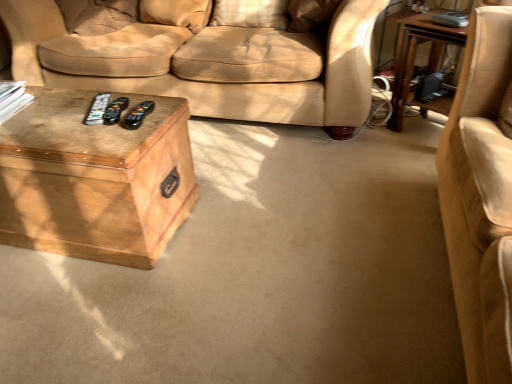
What is the approximate width of black plastic remote at center, the 1th remote in the left-to-right sequence?

It is 9.34 inches.

Image resolution: width=512 pixels, height=384 pixels. Describe the element at coordinates (138, 115) in the screenshot. I see `black plastic remote at center, which is counted as the first remote, starting from the right` at that location.

You are a GUI agent. You are given a task and a screenshot of the screen. Output one action in this format:
    pyautogui.click(x=<x>, y=<y>)
    Task: Click on the black plastic remote at center, the 2th remote viewed from the left
    The width and height of the screenshot is (512, 384).
    Given the screenshot: What is the action you would take?
    pyautogui.click(x=115, y=110)

Considering the relative sizes of black plastic remote at center, the 3th remote in the left-to-right sequence, and black plastic remote at center, arranged as the 2th remote when viewed from the right, in the image provided, is black plastic remote at center, the 3th remote in the left-to-right sequence, bigger than black plastic remote at center, arranged as the 2th remote when viewed from the right,?

Actually, black plastic remote at center, the 3th remote in the left-to-right sequence, might be smaller than black plastic remote at center, arranged as the 2th remote when viewed from the right.

Which is behind, point (127, 122) or point (125, 105)?

The point (125, 105) is farther.

In the image, is black plastic remote at center, the 3th remote in the left-to-right sequence, positioned in front of or behind black plastic remote at center, the 2th remote viewed from the left?

In the image, black plastic remote at center, the 3th remote in the left-to-right sequence, appears in front of black plastic remote at center, the 2th remote viewed from the left.

In order to click on remote below the black plastic remote at center, arranged as the 2th remote when viewed from the right (from the image's perspective) in this screenshot , I will do `click(138, 115)`.

From a real-world perspective, which is physically below, black plastic remote at center, arranged as the 2th remote when viewed from the right, or black plastic remote at center, which is counted as the first remote, starting from the right?

From a 3D spatial view, black plastic remote at center, arranged as the 2th remote when viewed from the right, is below.

Is black plastic remote at center, arranged as the 2th remote when viewed from the right, facing towards black plastic remote at center, the 3th remote in the left-to-right sequence?

No, black plastic remote at center, arranged as the 2th remote when viewed from the right, is not oriented towards black plastic remote at center, the 3th remote in the left-to-right sequence.

Which is less distant, (x=123, y=103) or (x=147, y=106)?

The point (x=147, y=106) is closer.

From the black plastic remote at center, the 3th remote in the left-to-right sequence, count the 1st remote to the left and point to it. Please provide its 2D coordinates.

[(115, 110)]

Is black plastic remote at center, marked as the 3th remote in a right-to-left arrangement, not close to wooden table at right, the second table when ordered from left to right?

Yes, black plastic remote at center, marked as the 3th remote in a right-to-left arrangement, and wooden table at right, the second table when ordered from left to right, are located far from each other.

Is black plastic remote at center, the 1th remote in the left-to-right sequence, positioned before wooden table at right, the second table when ordered from left to right?

Yes, it is.

Which object is positioned more to the right, black plastic remote at center, the 1th remote in the left-to-right sequence, or wooden table at right, the second table when ordered from left to right?

wooden table at right, the second table when ordered from left to right, is more to the right.

Is black plastic remote at center, the 1th remote in the left-to-right sequence, wider than wooden table at right, arranged as the first table when viewed from the right?

Incorrect, the width of black plastic remote at center, the 1th remote in the left-to-right sequence, does not surpass that of wooden table at right, arranged as the first table when viewed from the right.

Measure the distance between black plastic remote at center, marked as the 3th remote in a right-to-left arrangement, and black plastic remote at center, arranged as the 2th remote when viewed from the right.

black plastic remote at center, marked as the 3th remote in a right-to-left arrangement, and black plastic remote at center, arranged as the 2th remote when viewed from the right, are 1.56 inches apart from each other.

Considering the positions of objects black plastic remote at center, the 1th remote in the left-to-right sequence, and black plastic remote at center, the 2th remote viewed from the left, in the image provided, who is in front, black plastic remote at center, the 1th remote in the left-to-right sequence, or black plastic remote at center, the 2th remote viewed from the left,?

Positioned in front is black plastic remote at center, the 2th remote viewed from the left.

Considering the positions of points (89, 124) and (106, 119), is point (89, 124) closer to camera compared to point (106, 119)?

Yes, point (89, 124) is in front of point (106, 119).

Is black plastic remote at center, the 1th remote in the left-to-right sequence, next to black plastic remote at center, arranged as the 2th remote when viewed from the right, and touching it?

Yes, black plastic remote at center, the 1th remote in the left-to-right sequence, is in contact with black plastic remote at center, arranged as the 2th remote when viewed from the right.

Is wooden table at right, arranged as the first table when viewed from the right, turned away from wooden trunk at lower left, acting as the first table starting from the left?

That's not correct — wooden table at right, arranged as the first table when viewed from the right, is not looking away from wooden trunk at lower left, acting as the first table starting from the left.

Considering the sizes of wooden table at right, the second table when ordered from left to right, and wooden trunk at lower left, which is the second table in right-to-left order, in the image, is wooden table at right, the second table when ordered from left to right, taller or shorter than wooden trunk at lower left, which is the second table in right-to-left order,?

Considering their sizes, wooden table at right, the second table when ordered from left to right, has more height than wooden trunk at lower left, which is the second table in right-to-left order.

Is there a large distance between wooden table at right, arranged as the first table when viewed from the right, and wooden trunk at lower left, which is the second table in right-to-left order?

Absolutely, wooden table at right, arranged as the first table when viewed from the right, is distant from wooden trunk at lower left, which is the second table in right-to-left order.

Can you confirm if wooden table at right, the second table when ordered from left to right, is positioned to the left of wooden trunk at lower left, acting as the first table starting from the left?

No, wooden table at right, the second table when ordered from left to right, is not to the left of wooden trunk at lower left, acting as the first table starting from the left.

Looking at their sizes, would you say black plastic remote at center, the 3th remote in the left-to-right sequence, is wider or thinner than wooden table at right, the second table when ordered from left to right?

In the image, black plastic remote at center, the 3th remote in the left-to-right sequence, appears to be more narrow than wooden table at right, the second table when ordered from left to right.

Does point (139, 121) lie in front of point (398, 122)?

Yes, it is.

Could you tell me if black plastic remote at center, the 3th remote in the left-to-right sequence, is facing wooden table at right, arranged as the first table when viewed from the right?

No, black plastic remote at center, the 3th remote in the left-to-right sequence, is not aimed at wooden table at right, arranged as the first table when viewed from the right.

I want to click on the 3rd remote in front of the wooden table at right, arranged as the first table when viewed from the right, starting your count from the anchor, so coord(138,115).

From a real-world perspective, which object stands above the other?

wooden table at right, the second table when ordered from left to right, is physically above.

Is wooden trunk at lower left, which is the second table in right-to-left order, to the left of wooden table at right, arranged as the first table when viewed from the right, from the viewer's perspective?

Yes, wooden trunk at lower left, which is the second table in right-to-left order, is to the left of wooden table at right, arranged as the first table when viewed from the right.

Can we say wooden trunk at lower left, which is the second table in right-to-left order, lies outside wooden table at right, arranged as the first table when viewed from the right?

Absolutely, wooden trunk at lower left, which is the second table in right-to-left order, is external to wooden table at right, arranged as the first table when viewed from the right.

From the image's perspective, between wooden trunk at lower left, which is the second table in right-to-left order, and wooden table at right, arranged as the first table when viewed from the right, which one is located above?

wooden table at right, arranged as the first table when viewed from the right.

Locate an element on the screen. This screenshot has height=384, width=512. remote that is on the right side of black plastic remote at center, the 2th remote viewed from the left is located at coordinates (138, 115).

This screenshot has height=384, width=512. Find the location of `remote below the black plastic remote at center, arranged as the 2th remote when viewed from the right (from the image's perspective)`. remote below the black plastic remote at center, arranged as the 2th remote when viewed from the right (from the image's perspective) is located at coordinates (138, 115).

Looking at the image, which one is located closer to black plastic remote at center, the 3th remote in the left-to-right sequence, black plastic remote at center, marked as the 3th remote in a right-to-left arrangement, or wooden table at right, arranged as the first table when viewed from the right?

Among the two, black plastic remote at center, marked as the 3th remote in a right-to-left arrangement, is located nearer to black plastic remote at center, the 3th remote in the left-to-right sequence.

Based on their spatial positions, is wooden table at right, arranged as the first table when viewed from the right, or black plastic remote at center, marked as the 3th remote in a right-to-left arrangement, further from black plastic remote at center, the 3th remote in the left-to-right sequence?

wooden table at right, arranged as the first table when viewed from the right, lies further to black plastic remote at center, the 3th remote in the left-to-right sequence, than the other object.

Looking at the image, which one is located closer to black plastic remote at center, the 2th remote viewed from the left, wooden table at right, arranged as the first table when viewed from the right, or wooden trunk at lower left, which is the second table in right-to-left order?

The object closer to black plastic remote at center, the 2th remote viewed from the left, is wooden trunk at lower left, which is the second table in right-to-left order.

Which object lies further to the anchor point wooden table at right, arranged as the first table when viewed from the right, black plastic remote at center, the 1th remote in the left-to-right sequence, or black plastic remote at center, the 3th remote in the left-to-right sequence?

Based on the image, black plastic remote at center, the 1th remote in the left-to-right sequence, appears to be further to wooden table at right, arranged as the first table when viewed from the right.

Considering their positions, is black plastic remote at center, arranged as the 2th remote when viewed from the right, positioned closer to black plastic remote at center, the 1th remote in the left-to-right sequence, than black plastic remote at center, which is counted as the first remote, starting from the right?

Among the two, black plastic remote at center, arranged as the 2th remote when viewed from the right, is located nearer to black plastic remote at center, the 1th remote in the left-to-right sequence.

Looking at the image, which one is located further to wooden trunk at lower left, acting as the first table starting from the left, black plastic remote at center, which is counted as the first remote, starting from the right, or black plastic remote at center, the 2th remote viewed from the left?

black plastic remote at center, which is counted as the first remote, starting from the right, is further to wooden trunk at lower left, acting as the first table starting from the left.

Considering their positions, is black plastic remote at center, the 1th remote in the left-to-right sequence, positioned closer to black plastic remote at center, arranged as the 2th remote when viewed from the right, than wooden table at right, the second table when ordered from left to right?

black plastic remote at center, the 1th remote in the left-to-right sequence, lies closer to black plastic remote at center, arranged as the 2th remote when viewed from the right, than the other object.

Based on their spatial positions, is black plastic remote at center, which is counted as the first remote, starting from the right, or black plastic remote at center, the 2th remote viewed from the left, further from wooden table at right, the second table when ordered from left to right?

black plastic remote at center, the 2th remote viewed from the left, is positioned further to the anchor wooden table at right, the second table when ordered from left to right.

I want to click on remote located between black plastic remote at center, marked as the 3th remote in a right-to-left arrangement, and black plastic remote at center, which is counted as the first remote, starting from the right, in the left-right direction, so click(x=115, y=110).

Find the location of a particular element. This screenshot has width=512, height=384. remote situated between black plastic remote at center, arranged as the 2th remote when viewed from the right, and wooden table at right, arranged as the first table when viewed from the right, from left to right is located at coordinates (138, 115).

Where is `remote between wooden trunk at lower left, which is the second table in right-to-left order, and black plastic remote at center, the 2th remote viewed from the left, in the horizontal direction`? The image size is (512, 384). remote between wooden trunk at lower left, which is the second table in right-to-left order, and black plastic remote at center, the 2th remote viewed from the left, in the horizontal direction is located at coordinates (98, 109).